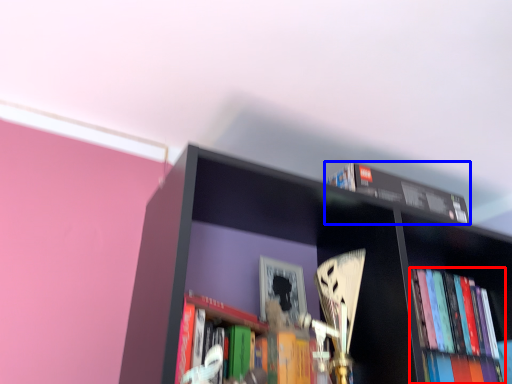
Question: Among these objects, which one is farthest to the camera, book (highlighted by a red box) or book (highlighted by a blue box)?

Choices:
 (A) book
 (B) book

Answer: (A)